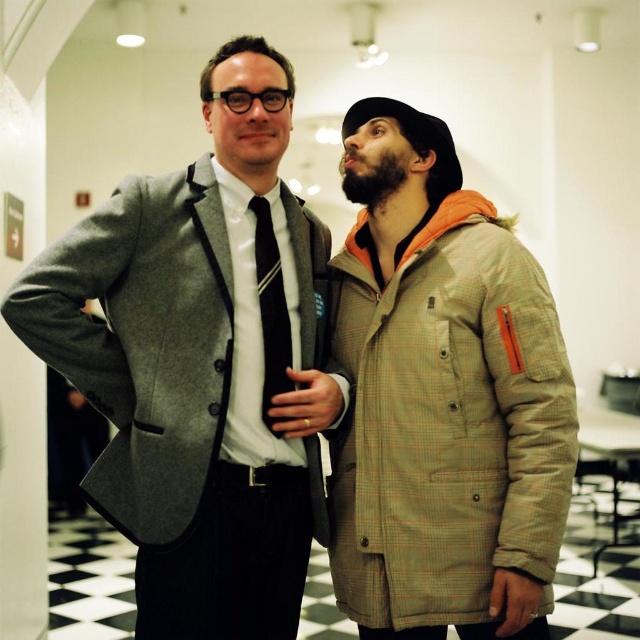
You are a tailor who needs to adjust the length of the matte gray blazer at center and the black silk tie at center. Based on their positions in the image, which clothing item is closer to the ground?

The matte gray blazer at center is positioned under the black silk tie at center, so the matte gray blazer at center is closer to the ground.

You are standing in the room and want to know which of the two points, point (228, 214) or point (504, 259), is closer to you. Based on the scene, can you determine which one is nearer?

Point (228, 214) is closer to you because it is further to the camera than point (504, 259).

You are organizing a charity clothing drive and need to determine if the larger of the two jackets will fit in a standard donation bin that can hold items up to 18 inches in length. The matte gray blazer at center and plaid wool jacket at right are both available. Which jacket should you choose, and will it fit?

The matte gray blazer at center has a larger size compared to plaid wool jacket at right. Since the donation bin can hold items up to 18 inches in length, you should choose the matte gray blazer at center. However, the description does not provide specific measurements, so we cannot confirm if it will fit within the 18 inch limit. Please measure the blazer before placing it in the bin.